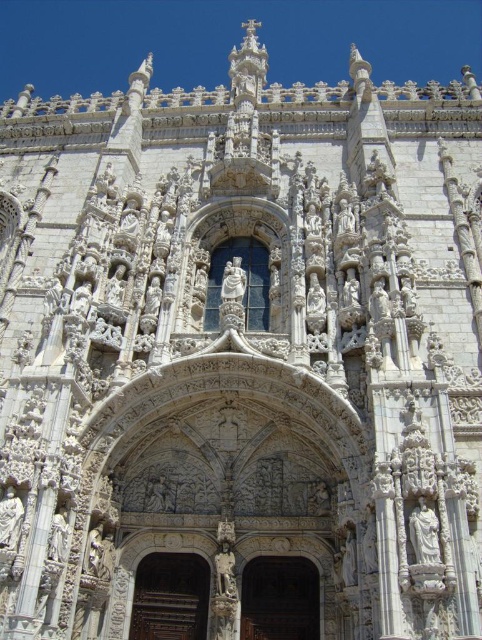
Question: Which point is farther to the camera?

Choices:
 (A) (284, 611)
 (B) (190, 577)

Answer: (B)

Question: Can you confirm if wooden door at center is smaller than brown wood door at center?

Choices:
 (A) no
 (B) yes

Answer: (A)

Question: Does wooden door at center have a lesser width compared to brown wood door at center?

Choices:
 (A) yes
 (B) no

Answer: (A)

Question: Is wooden door at center below brown wood door at center?

Choices:
 (A) no
 (B) yes

Answer: (A)

Question: Which point is farther from the camera taking this photo?

Choices:
 (A) (175, 593)
 (B) (285, 560)

Answer: (B)

Question: Which of the following is the farthest from the observer?

Choices:
 (A) (282, 637)
 (B) (188, 630)

Answer: (B)